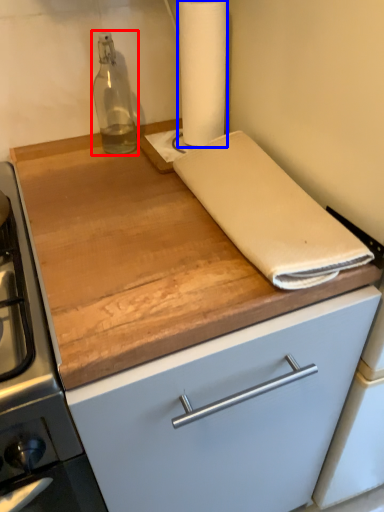
Question: Which of the following is the farthest to the observer, bottle (highlighted by a red box) or paper towel (highlighted by a blue box)?

Choices:
 (A) bottle
 (B) paper towel

Answer: (A)